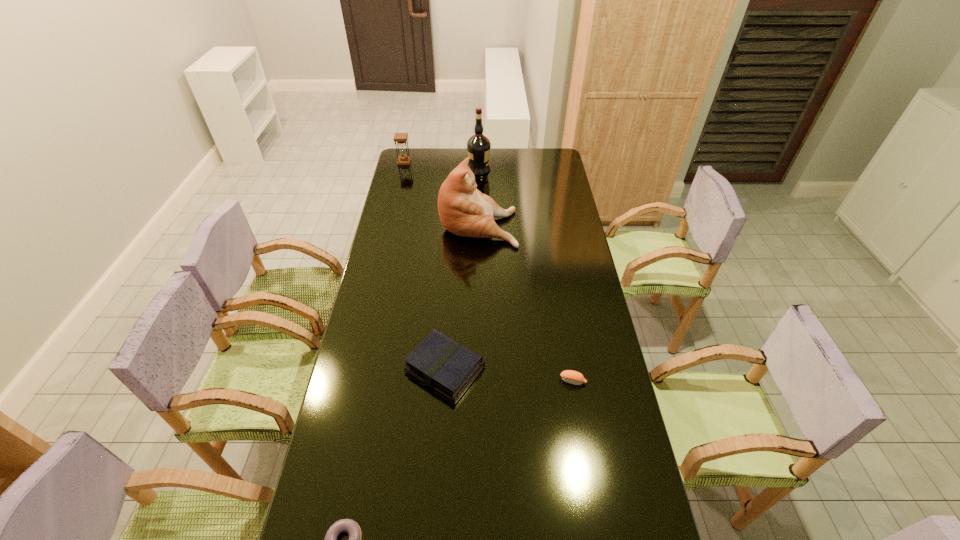
At what (x,y) coordinates should I click in order to perform the action: click on liquor. Please return your answer as a coordinate pair (x, y). Looking at the image, I should click on (478, 146).

Find the location of a particular element. This screenshot has height=540, width=960. cat is located at coordinates (463, 210).

You are a GUI agent. You are given a task and a screenshot of the screen. Output one action in this format:
    pyautogui.click(x=<x>, y=<y>)
    Task: Click on the third tallest object
    
    Given the screenshot: What is the action you would take?
    pyautogui.click(x=403, y=159)

Image resolution: width=960 pixels, height=540 pixels. I want to click on the third shortest object, so click(x=441, y=363).

You are a GUI agent. You are given a task and a screenshot of the screen. Output one action in this format:
    pyautogui.click(x=<x>, y=<y>)
    Task: Click on the sushi
    The width and height of the screenshot is (960, 540).
    Given the screenshot: What is the action you would take?
    pyautogui.click(x=573, y=377)

Identify the location of the rightmost object. This screenshot has width=960, height=540. (573, 377).

This screenshot has height=540, width=960. I want to click on free region located 0.370m on the surface of the liquor, so click(562, 170).

Identify the location of vacant space located on the face of the cat. (x=550, y=224).

Identify the location of vacant point located 0.080m on the right of the third tallest object. (425, 162).

Where is `free space located 0.350m on the back of the third shortest object`? This screenshot has width=960, height=540. free space located 0.350m on the back of the third shortest object is located at coordinates (451, 267).